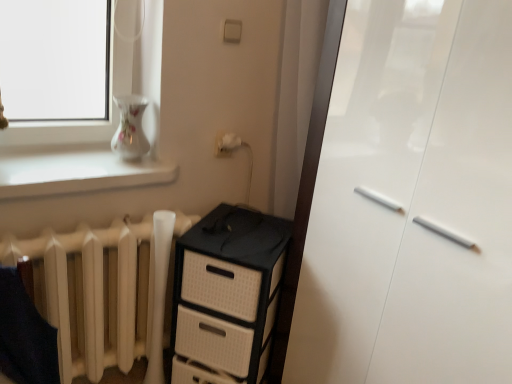
The width and height of the screenshot is (512, 384). Identify the location of black plastic chest of drawers at center. (x=227, y=295).

What do you see at coordinates (77, 172) in the screenshot? I see `white glossy vase at upper left` at bounding box center [77, 172].

What is the approximate width of white matte radiator at lower left?

The width of white matte radiator at lower left is 6.82 inches.

Locate an element on the screen. This screenshot has width=512, height=384. black plastic chest of drawers at center is located at coordinates (227, 295).

From the image's perspective, is white glossy cabinet at right on white glossy vase at upper left?

No, from the image's perspective, white glossy cabinet at right is not above white glossy vase at upper left.

Can you confirm if white glossy cabinet at right is bigger than white glossy vase at upper left?

Yes, white glossy cabinet at right is bigger than white glossy vase at upper left.

Would you consider white glossy cabinet at right to be distant from white glossy vase at upper left?

No, white glossy cabinet at right is in close proximity to white glossy vase at upper left.

Is white glossy cabinet at right in front of white glossy vase at upper left?

Yes, it is in front of white glossy vase at upper left.

Based on the photo, from the image's perspective, is black plastic chest of drawers at center beneath white matte radiator at lower left?

Yes, from the image's perspective, black plastic chest of drawers at center is below white matte radiator at lower left.

How much distance is there between black plastic chest of drawers at center and white matte radiator at lower left?

A distance of 10.33 inches exists between black plastic chest of drawers at center and white matte radiator at lower left.

From a real-world perspective, which is physically above, black plastic chest of drawers at center or white matte radiator at lower left?

From a 3D spatial view, white matte radiator at lower left is above.

From the image's perspective, does black plastic chest of drawers at center appear lower than white glossy cabinet at right?

Yes, from the image's perspective, black plastic chest of drawers at center is beneath white glossy cabinet at right.

Between black plastic chest of drawers at center and white glossy cabinet at right, which one has larger width?

white glossy cabinet at right is wider.

Is black plastic chest of drawers at center next to white glossy cabinet at right?

black plastic chest of drawers at center and white glossy cabinet at right are not in contact.

Does black plastic chest of drawers at center lie in front of white glossy cabinet at right?

No, the depth of black plastic chest of drawers at center is greater than that of white glossy cabinet at right.

Does point (499, 318) come in front of point (150, 222)?

Yes, point (499, 318) is closer to viewer.

How many degrees apart are the facing directions of white glossy cabinet at right and white matte radiator at lower left?

The angular difference between white glossy cabinet at right and white matte radiator at lower left is 90.6 degrees.

Could you tell me if white glossy cabinet at right is turned towards white matte radiator at lower left?

No, white glossy cabinet at right does not turn towards white matte radiator at lower left.

Considering the relative sizes of white glossy cabinet at right and white matte radiator at lower left in the image provided, is white glossy cabinet at right shorter than white matte radiator at lower left?

In fact, white glossy cabinet at right may be taller than white matte radiator at lower left.

Is white glossy vase at upper left closer to the viewer compared to white glossy cabinet at right?

That is False.

Could you tell me if white glossy vase at upper left is turned towards white glossy cabinet at right?

No, white glossy vase at upper left is not turned towards white glossy cabinet at right.

In the scene shown: From a real-world perspective, which is physically below, white glossy vase at upper left or black plastic chest of drawers at center?

black plastic chest of drawers at center, from a real-world perspective.

Looking at this image, is white glossy vase at upper left closer to the viewer compared to black plastic chest of drawers at center?

Yes, it is in front of black plastic chest of drawers at center.

Considering the relative positions of white glossy vase at upper left and black plastic chest of drawers at center in the image provided, is white glossy vase at upper left to the left of black plastic chest of drawers at center from the viewer's perspective?

Indeed, white glossy vase at upper left is positioned on the left side of black plastic chest of drawers at center.

Is white glossy vase at upper left inside the boundaries of black plastic chest of drawers at center, or outside?

white glossy vase at upper left is not enclosed by black plastic chest of drawers at center.

Who is smaller, white glossy vase at upper left or white matte radiator at lower left?

With smaller size is white glossy vase at upper left.

Is white matte radiator at lower left surrounded by white glossy vase at upper left?

Definitely not — white matte radiator at lower left is not inside white glossy vase at upper left.

Is point (114, 173) closer or farther from the camera than point (65, 272)?

Clearly, point (114, 173) is more distant from the camera than point (65, 272).

Locate an element on the screen. This screenshot has width=512, height=384. radiator below the white glossy vase at upper left (from a real-world perspective) is located at coordinates (94, 293).

This screenshot has width=512, height=384. Identify the location of window sill behind the white glossy cabinet at right. (77, 172).

The width and height of the screenshot is (512, 384). I want to click on the chest of drawers directly beneath the white matte radiator at lower left (from a real-world perspective), so click(x=227, y=295).

In the scene shown: From the image, which object appears to be nearer to black plastic chest of drawers at center, white matte radiator at lower left or white glossy vase at upper left?

white matte radiator at lower left is closer to black plastic chest of drawers at center.

Based on their spatial positions, is white glossy cabinet at right or black plastic chest of drawers at center further from white matte radiator at lower left?

Among the two, white glossy cabinet at right is located further to white matte radiator at lower left.

When comparing their distances from white glossy vase at upper left, does black plastic chest of drawers at center or white glossy cabinet at right seem further?

Among the two, white glossy cabinet at right is located further to white glossy vase at upper left.

Considering their positions, is white glossy vase at upper left positioned closer to white matte radiator at lower left than white glossy cabinet at right?

white glossy vase at upper left is positioned closer to the anchor white matte radiator at lower left.

Considering their positions, is black plastic chest of drawers at center positioned further to white glossy vase at upper left than white matte radiator at lower left?

Based on the image, black plastic chest of drawers at center appears to be further to white glossy vase at upper left.

Which object lies further to the anchor point black plastic chest of drawers at center, white glossy cabinet at right or white matte radiator at lower left?

Based on the image, white glossy cabinet at right appears to be further to black plastic chest of drawers at center.

When comparing their distances from black plastic chest of drawers at center, does white glossy vase at upper left or white glossy cabinet at right seem further?

white glossy vase at upper left is positioned further to the anchor black plastic chest of drawers at center.

Considering their positions, is white glossy cabinet at right positioned closer to white glossy vase at upper left than white matte radiator at lower left?

white matte radiator at lower left lies closer to white glossy vase at upper left than the other object.

Where is `radiator between white glossy vase at upper left and black plastic chest of drawers at center in the up-down direction`? This screenshot has width=512, height=384. radiator between white glossy vase at upper left and black plastic chest of drawers at center in the up-down direction is located at coordinates (94, 293).

Image resolution: width=512 pixels, height=384 pixels. Identify the location of radiator situated between white glossy vase at upper left and white glossy cabinet at right from left to right. (94, 293).

I want to click on chest of drawers between white matte radiator at lower left and white glossy cabinet at right in the horizontal direction, so click(x=227, y=295).

Locate an element on the screen. the chest of drawers situated between white glossy vase at upper left and white glossy cabinet at right from left to right is located at coordinates (227, 295).